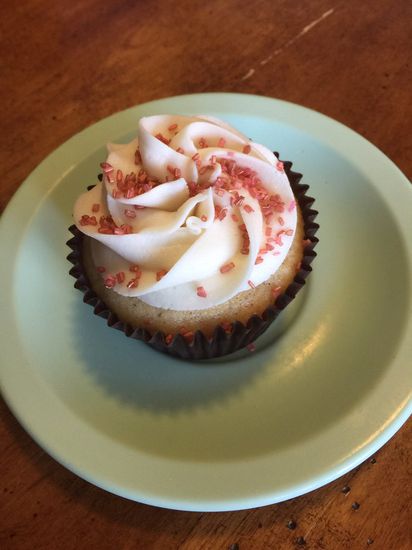
Locate an element on the screen. wooden table is located at coordinates (25, 27), (374, 25), (387, 115), (236, 34), (88, 90), (25, 484), (118, 527), (319, 528), (393, 471).